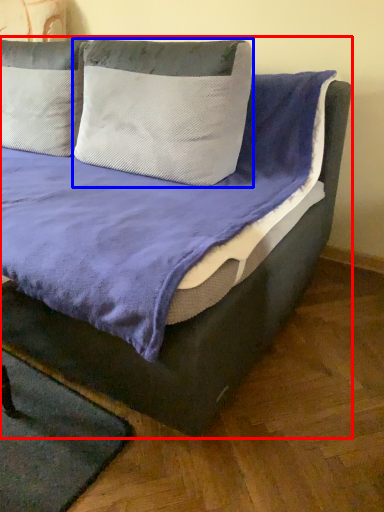
Question: Among these objects, which one is nearest to the camera, bed (highlighted by a red box) or pillow (highlighted by a blue box)?

Choices:
 (A) bed
 (B) pillow

Answer: (A)